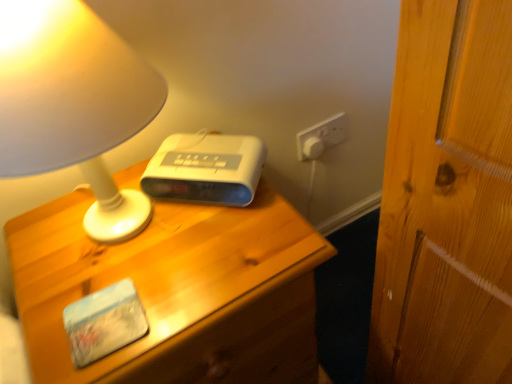
Question: Would you say matte white lamp at upper left is outside white plastic alarm clock at center?

Choices:
 (A) yes
 (B) no

Answer: (A)

Question: From a real-world perspective, is matte white lamp at upper left under white plastic alarm clock at center?

Choices:
 (A) yes
 (B) no

Answer: (B)

Question: Is matte white lamp at upper left positioned behind white plastic alarm clock at center?

Choices:
 (A) yes
 (B) no

Answer: (B)

Question: From a real-world perspective, is matte white lamp at upper left located higher than white plastic alarm clock at center?

Choices:
 (A) yes
 (B) no

Answer: (A)

Question: Can you confirm if matte white lamp at upper left is taller than white plastic alarm clock at center?

Choices:
 (A) no
 (B) yes

Answer: (B)

Question: From the image's perspective, is matte white lamp at upper left beneath white plastic alarm clock at center?

Choices:
 (A) yes
 (B) no

Answer: (B)

Question: Considering the relative sizes of white plastic alarm clock at center and matte white lamp at upper left in the image provided, is white plastic alarm clock at center shorter than matte white lamp at upper left?

Choices:
 (A) yes
 (B) no

Answer: (A)

Question: Can you confirm if white plastic alarm clock at center is taller than matte white lamp at upper left?

Choices:
 (A) no
 (B) yes

Answer: (A)

Question: Is white plastic alarm clock at center touching matte white lamp at upper left?

Choices:
 (A) no
 (B) yes

Answer: (A)

Question: Is white plastic alarm clock at center wider than matte white lamp at upper left?

Choices:
 (A) yes
 (B) no

Answer: (B)

Question: Is white plastic alarm clock at center far away from matte white lamp at upper left?

Choices:
 (A) yes
 (B) no

Answer: (B)

Question: Is white plastic alarm clock at center to the right of matte white lamp at upper left from the viewer's perspective?

Choices:
 (A) no
 (B) yes

Answer: (B)

Question: Could you tell me if white plastic alarm clock at center is facing wooden nightstand at center?

Choices:
 (A) yes
 (B) no

Answer: (B)